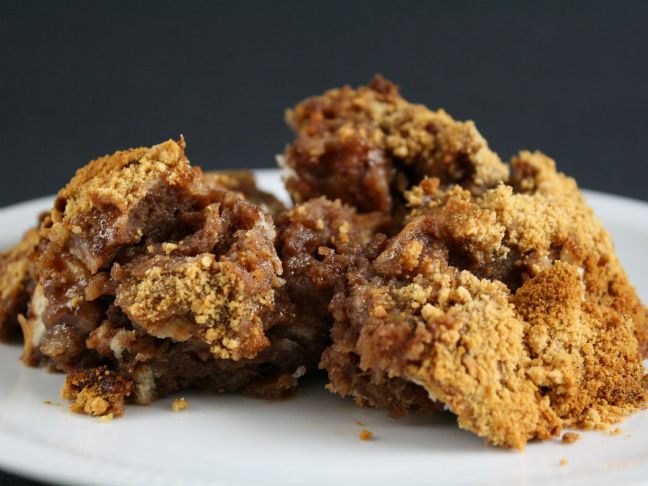
Where is `white plate`? white plate is located at coordinates (277, 454).